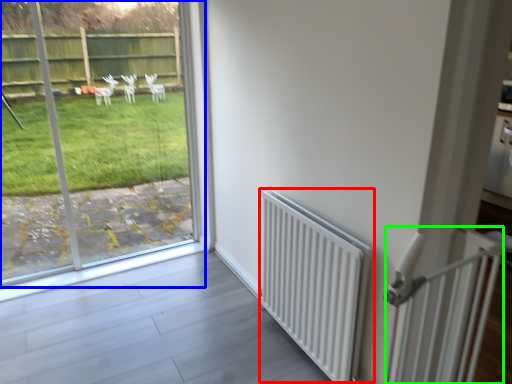
Question: Estimate the real-world distances between objects in this image. Which object is farther from radiator (highlighted by a red box), window (highlighted by a blue box) or balustrade (highlighted by a green box)?

Choices:
 (A) window
 (B) balustrade

Answer: (A)